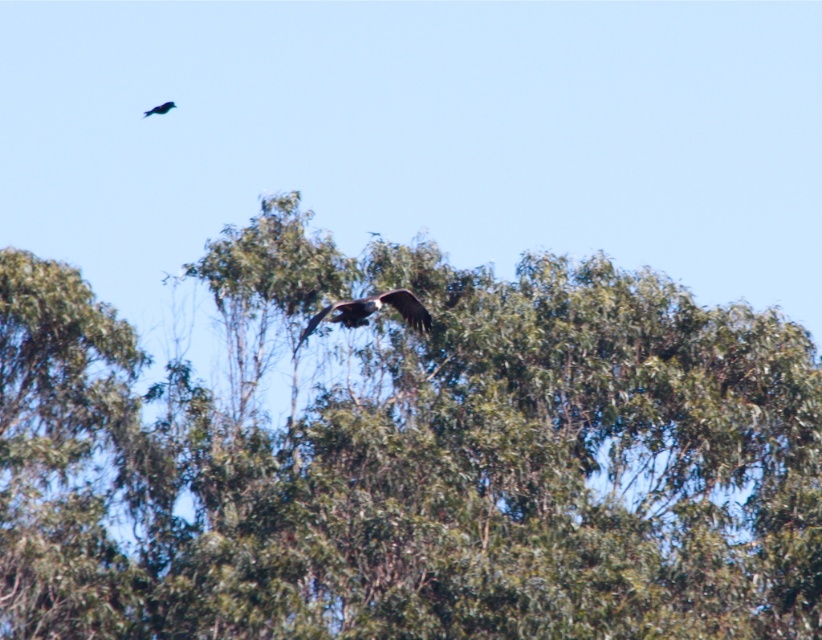
You are standing in the middle of the forest depicted in the image. You notice two points marked in the scene. According to their positions, which point is closer to you, point (336, 321) or point (142, 112)?

Point (336, 321) is in front of point (142, 112), so it is closer to you.

You are a hiker standing in the forest looking up at the green leafy tree at center and the shiny black bird at upper left. Which object is higher from the ground?

The shiny black bird at upper left is higher from the ground than the green leafy tree at center because it is positioned above the tree.

Based on the photo, you are an ornithologist observing this scene. You notice two birds in the sky. The brown feathered eagle at center and the shiny black bird at upper left. Which bird is flying at a lower altitude?

The brown feathered eagle at center is positioned under the shiny black bird at upper left, so it is flying at a lower altitude.